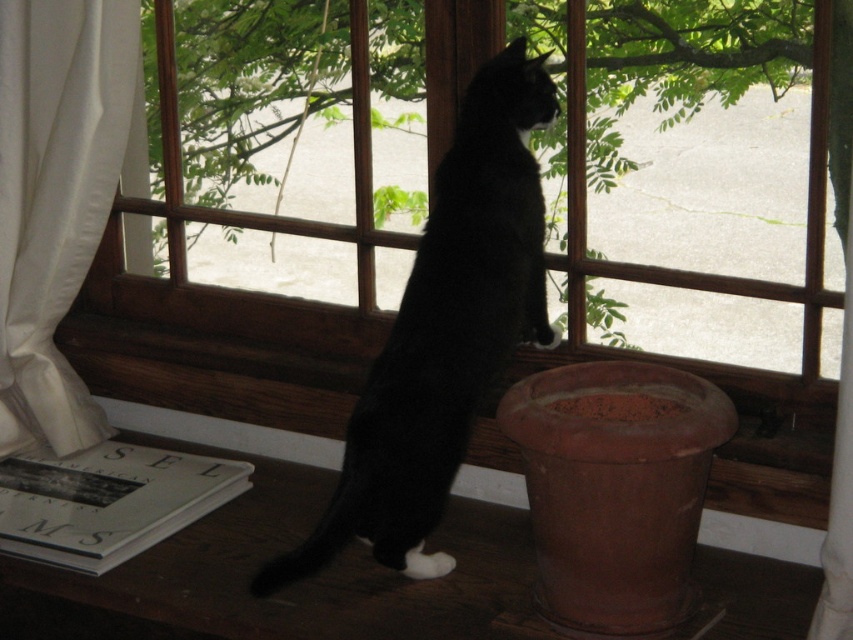
Is matte brown pot at lower right taller than black fur cat at center?

In fact, matte brown pot at lower right may be shorter than black fur cat at center.

Is matte brown pot at lower right further to camera compared to black fur cat at center?

No.

The width and height of the screenshot is (853, 640). Describe the element at coordinates (296, 541) in the screenshot. I see `matte brown pot at lower right` at that location.

Identify the location of matte brown pot at lower right. (296, 541).

Does wooden frame at center appear over matte brown pot at lower right?

Indeed, wooden frame at center is positioned over matte brown pot at lower right.

Between wooden frame at center and matte brown pot at lower right, which one appears on the right side from the viewer's perspective?

wooden frame at center is more to the right.

You are a GUI agent. You are given a task and a screenshot of the screen. Output one action in this format:
    pyautogui.click(x=<x>, y=<y>)
    Task: Click on the wooden frame at center
    This screenshot has height=640, width=853.
    Given the screenshot: What is the action you would take?
    pyautogui.click(x=273, y=232)

Identify the location of wooden frame at center. (273, 232).

Is black fur cat at center above white fabric curtain at left?

No, black fur cat at center is not above white fabric curtain at left.

Does black fur cat at center have a greater width compared to white fabric curtain at left?

Indeed, black fur cat at center has a greater width compared to white fabric curtain at left.

Is point (543, 316) more distant than point (42, 205)?

No, (543, 316) is in front of (42, 205).

You are a GUI agent. You are given a task and a screenshot of the screen. Output one action in this format:
    pyautogui.click(x=<x>, y=<y>)
    Task: Click on the black fur cat at center
    The image size is (853, 640).
    Given the screenshot: What is the action you would take?
    pyautogui.click(x=444, y=332)